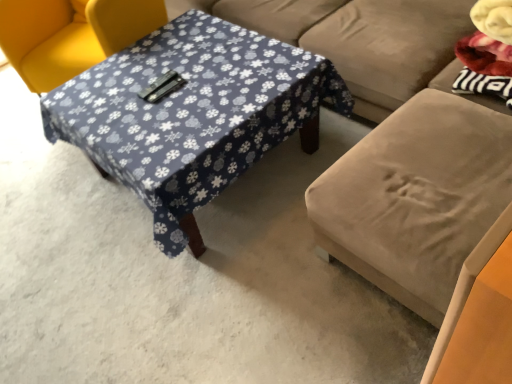
Question: Could blue fabric-covered table at center be considered to be inside velvet beige studio couch at center?

Choices:
 (A) no
 (B) yes

Answer: (B)

Question: Could you tell me if velvet beige studio couch at center is facing blue fabric-covered table at center?

Choices:
 (A) yes
 (B) no

Answer: (A)

Question: Does velvet beige studio couch at center come behind blue fabric-covered table at center?

Choices:
 (A) yes
 (B) no

Answer: (B)

Question: From the image's perspective, is velvet beige studio couch at center above blue fabric-covered table at center?

Choices:
 (A) yes
 (B) no

Answer: (A)

Question: Does velvet beige studio couch at center have a smaller size compared to blue fabric-covered table at center?

Choices:
 (A) no
 (B) yes

Answer: (A)

Question: From a real-world perspective, is velvet beige studio couch at center physically above blue fabric-covered table at center?

Choices:
 (A) no
 (B) yes

Answer: (B)

Question: Does yellow fabric chair at upper left appear on the left side of blue fabric-covered table at center?

Choices:
 (A) yes
 (B) no

Answer: (A)

Question: From the image's perspective, is yellow fabric chair at upper left under blue fabric-covered table at center?

Choices:
 (A) yes
 (B) no

Answer: (B)

Question: From a real-world perspective, does yellow fabric chair at upper left stand above blue fabric-covered table at center?

Choices:
 (A) yes
 (B) no

Answer: (A)

Question: Does yellow fabric chair at upper left have a greater height compared to blue fabric-covered table at center?

Choices:
 (A) no
 (B) yes

Answer: (B)

Question: Considering the relative positions of yellow fabric chair at upper left and blue fabric-covered table at center in the image provided, is yellow fabric chair at upper left in front of blue fabric-covered table at center?

Choices:
 (A) yes
 (B) no

Answer: (B)

Question: From the image's perspective, is yellow fabric chair at upper left located above blue fabric-covered table at center?

Choices:
 (A) no
 (B) yes

Answer: (B)

Question: Is velvet beige studio couch at center taller than yellow fabric chair at upper left?

Choices:
 (A) yes
 (B) no

Answer: (A)